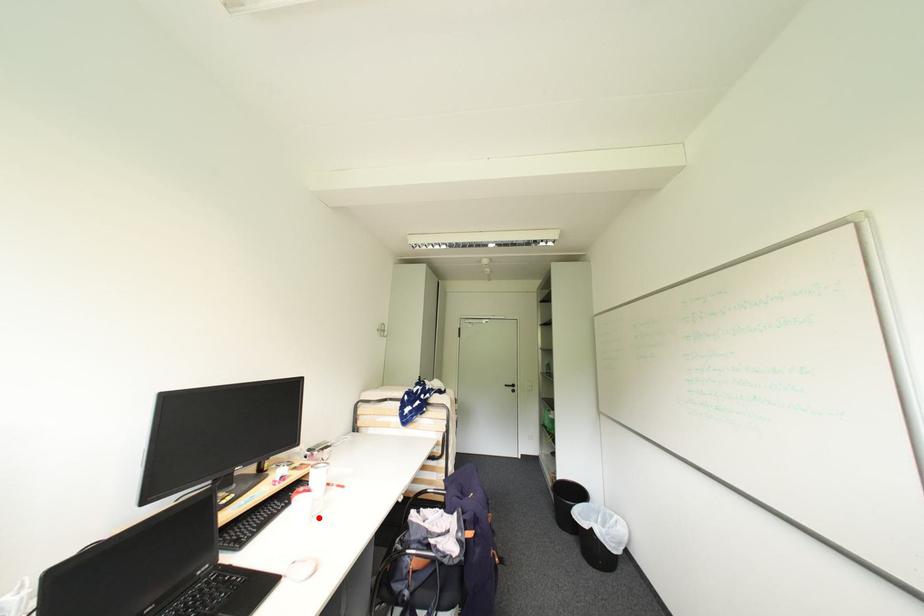
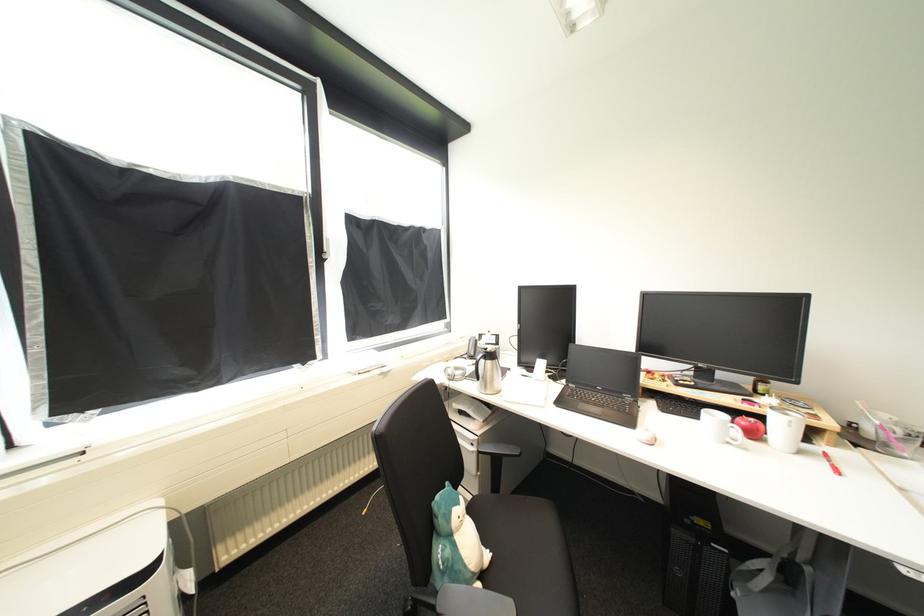
In the second image, find the point that corresponds to the highlighted location in the first image.

(736, 445)